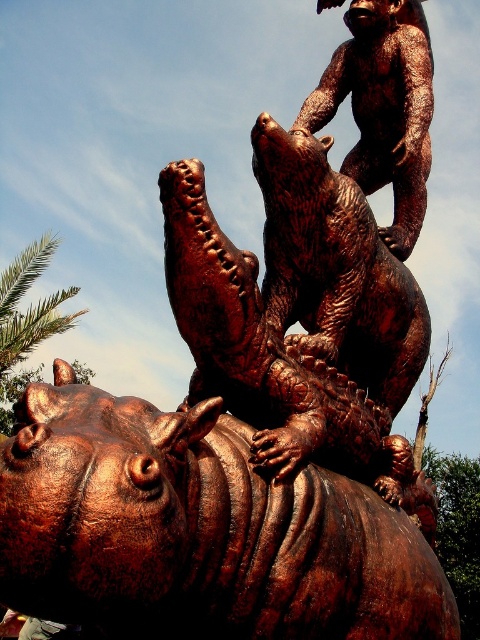
You are an art conservator examining the bronze sculpture. You need to clean the bronze bear at upper center and the bronze textured hippo at center. Which object should you clean first if you want to start from the lowest part of the sculpture?

You should clean the bronze textured hippo at center first because it is positioned under the bronze bear at upper center, making it the lower part of the sculpture.

You are an art conservator examining the bronze sculpture. You need to clean the bronze textured hippo at center and the bronze bear at upper center. Which object should you clean first if you want to start with the one closer to the front?

The bronze textured hippo at center is in front of the bronze bear at upper center, so you should clean the bronze textured hippo at center first.